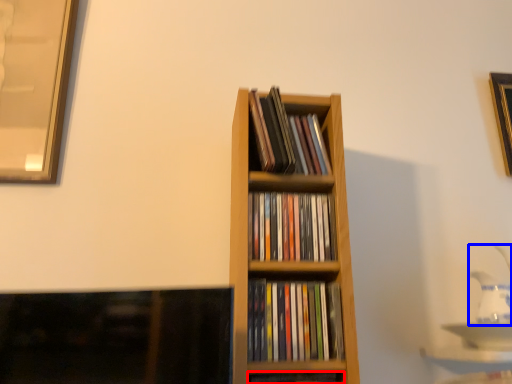
Question: Which of the following is the closest to the observer, book (highlighted by a red box) or tea pot (highlighted by a blue box)?

Choices:
 (A) book
 (B) tea pot

Answer: (A)